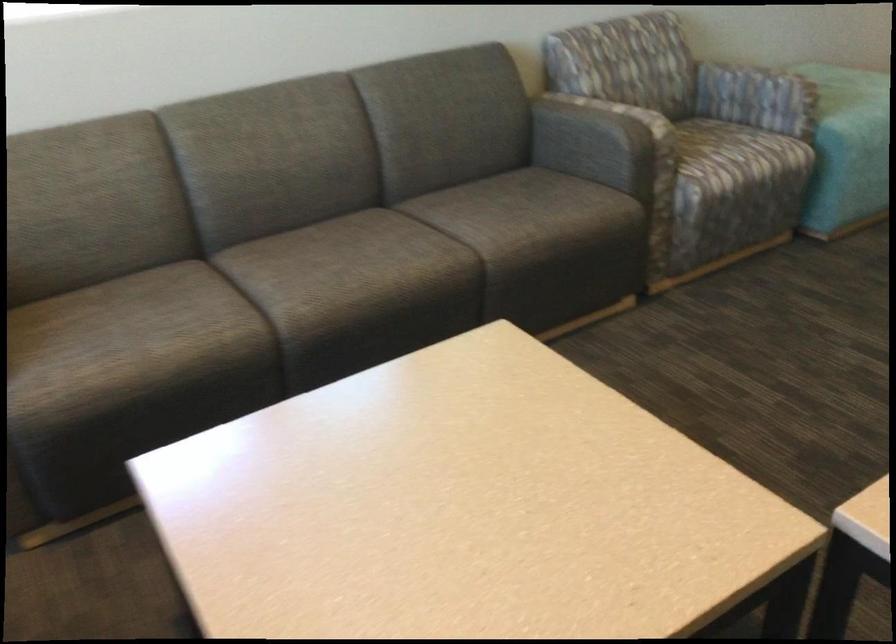
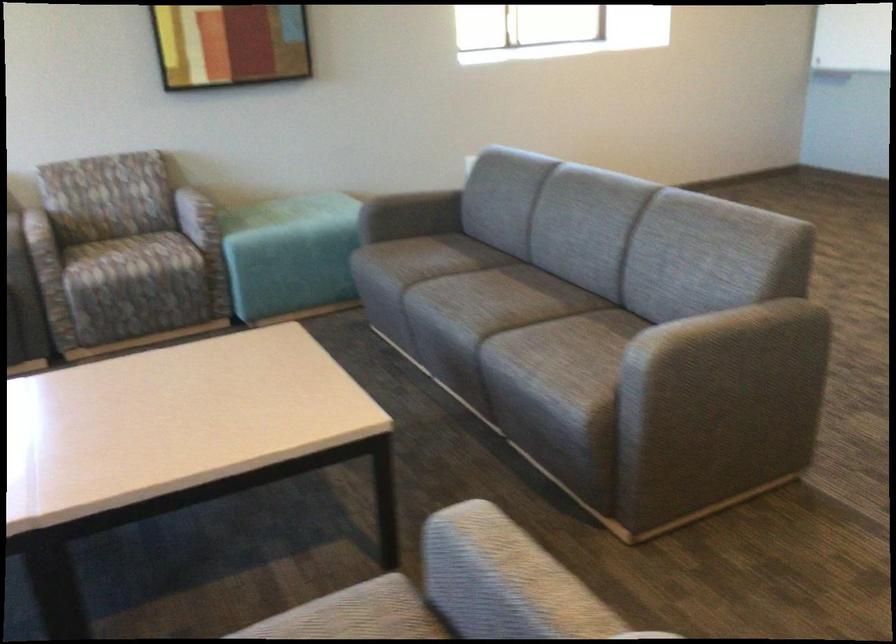
Where in the second image is the point corresponding to [773,88] from the first image?

(197, 216)